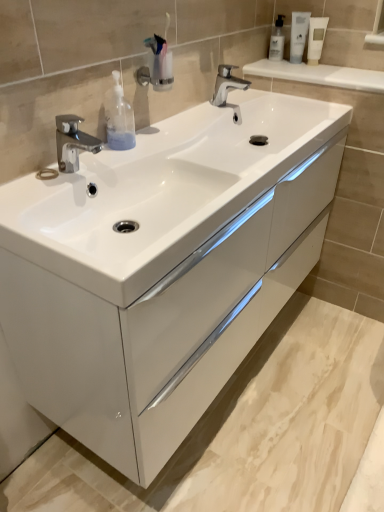
Question: Considering the relative positions of transparent plastic bottle at left and polished chrome faucet at left, the 1th tap positioned from the bottom, in the image provided, is transparent plastic bottle at left to the right of polished chrome faucet at left, the 1th tap positioned from the bottom, from the viewer's perspective?

Choices:
 (A) yes
 (B) no

Answer: (A)

Question: Is polished chrome faucet at left, which is the 2th tap in top-to-bottom order, a part of transparent plastic bottle at left?

Choices:
 (A) no
 (B) yes

Answer: (A)

Question: Is transparent plastic bottle at left looking in the opposite direction of polished chrome faucet at left, which is the 2th tap in top-to-bottom order?

Choices:
 (A) yes
 (B) no

Answer: (B)

Question: Can you confirm if transparent plastic bottle at left is taller than polished chrome faucet at left, placed as the second tap when sorted from back to front?

Choices:
 (A) no
 (B) yes

Answer: (B)

Question: From the image's perspective, does transparent plastic bottle at left appear lower than polished chrome faucet at left, which ranks as the first tap in front-to-back order?

Choices:
 (A) yes
 (B) no

Answer: (B)

Question: In the image, is white matte tube at upper right, positioned as the 3th mouthwash in left-to-right order, on the left side or the right side of white glossy tube at upper right, placed as the 2th mouthwash when sorted from right to left?

Choices:
 (A) left
 (B) right

Answer: (B)

Question: Looking at their shapes, would you say white matte tube at upper right, the first mouthwash viewed from the right, is wider or thinner than white glossy tube at upper right, which appears as the 2th mouthwash when viewed from the left?

Choices:
 (A) thin
 (B) wide

Answer: (A)

Question: Based on their sizes in the image, would you say white matte tube at upper right, the first mouthwash viewed from the right, is bigger or smaller than white glossy tube at upper right, which appears as the 2th mouthwash when viewed from the left?

Choices:
 (A) small
 (B) big

Answer: (A)

Question: In the image, is white matte tube at upper right, positioned as the 3th mouthwash in left-to-right order, positioned in front of or behind white glossy tube at upper right, placed as the 2th mouthwash when sorted from right to left?

Choices:
 (A) behind
 (B) front

Answer: (B)

Question: Does point (134, 125) appear closer or farther from the camera than point (215, 103)?

Choices:
 (A) farther
 (B) closer

Answer: (B)

Question: Is transparent plastic bottle at left to the left or to the right of polished chrome faucet at center, marked as the 2th tap in a bottom-to-top arrangement, in the image?

Choices:
 (A) left
 (B) right

Answer: (A)

Question: Looking at the image, does transparent plastic bottle at left seem bigger or smaller compared to polished chrome faucet at center, acting as the 1th tap starting from the right?

Choices:
 (A) small
 (B) big

Answer: (A)

Question: From a real-world perspective, is transparent plastic bottle at left positioned above or below polished chrome faucet at center, arranged as the second tap when viewed from the front?

Choices:
 (A) above
 (B) below

Answer: (A)

Question: From the image's perspective, is white glossy tube at upper right, which appears as the 2th mouthwash when viewed from the left, above or below transparent plastic bottle at left?

Choices:
 (A) above
 (B) below

Answer: (A)

Question: Looking at the image, does white glossy tube at upper right, which appears as the 2th mouthwash when viewed from the left, seem bigger or smaller compared to transparent plastic bottle at left?

Choices:
 (A) small
 (B) big

Answer: (A)